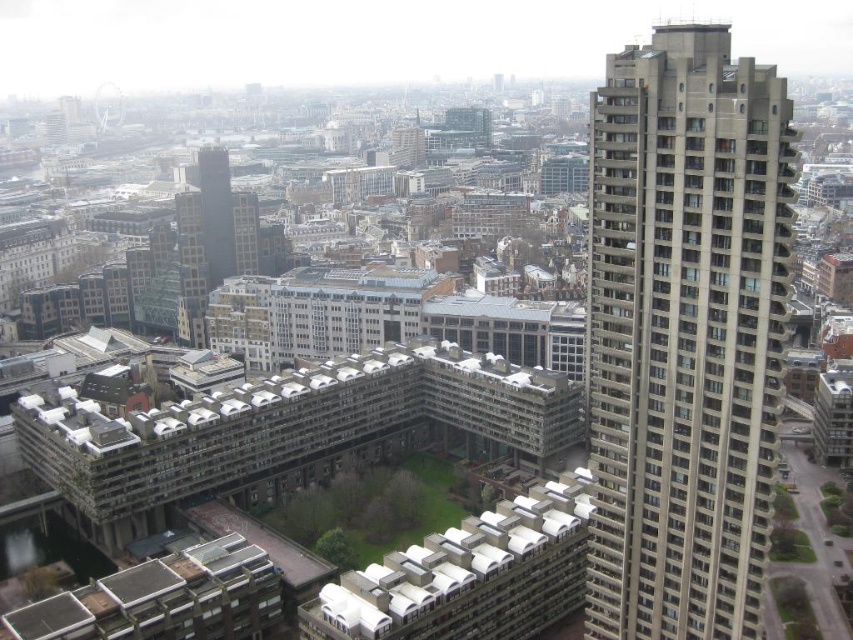
Does gray concrete building at right have a larger size compared to smooth glass skyscraper at center-left?

No.

The image size is (853, 640). I want to click on gray concrete building at right, so click(x=683, y=333).

This screenshot has height=640, width=853. Find the location of `gray concrete building at right`. gray concrete building at right is located at coordinates (683, 333).